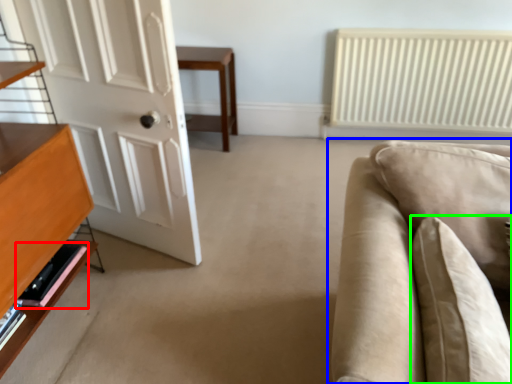
Question: Considering the real-world distances, which object is farthest from shelf (highlighted by a red box)? studio couch (highlighted by a blue box) or pillow (highlighted by a green box)?

Choices:
 (A) studio couch
 (B) pillow

Answer: (B)